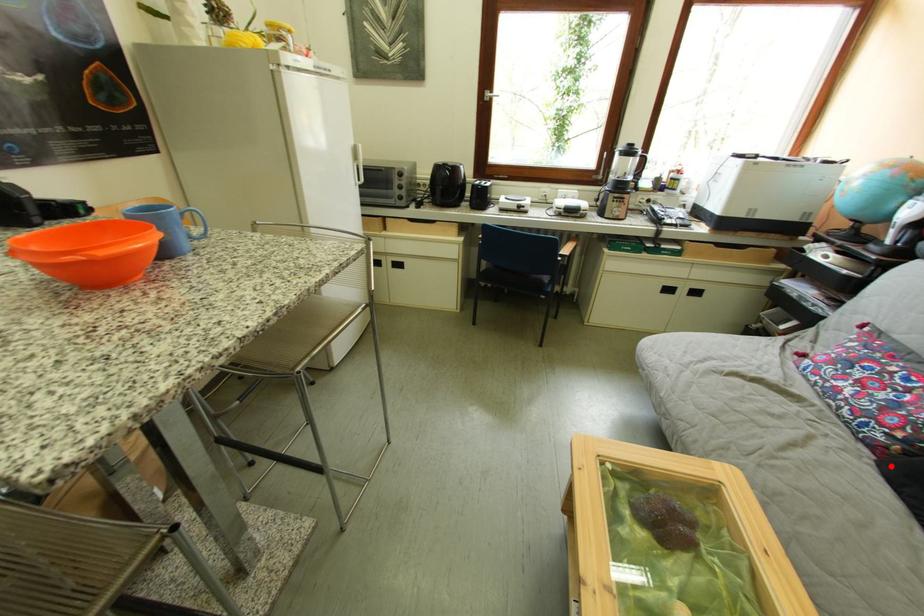
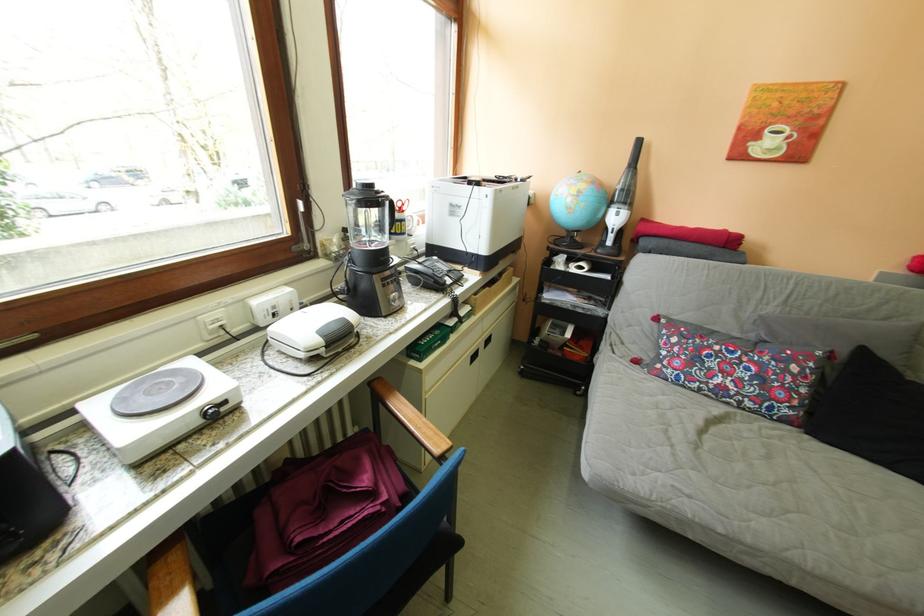
In the second image, find the point that corresponds to the highlighted location in the first image.

(821, 437)